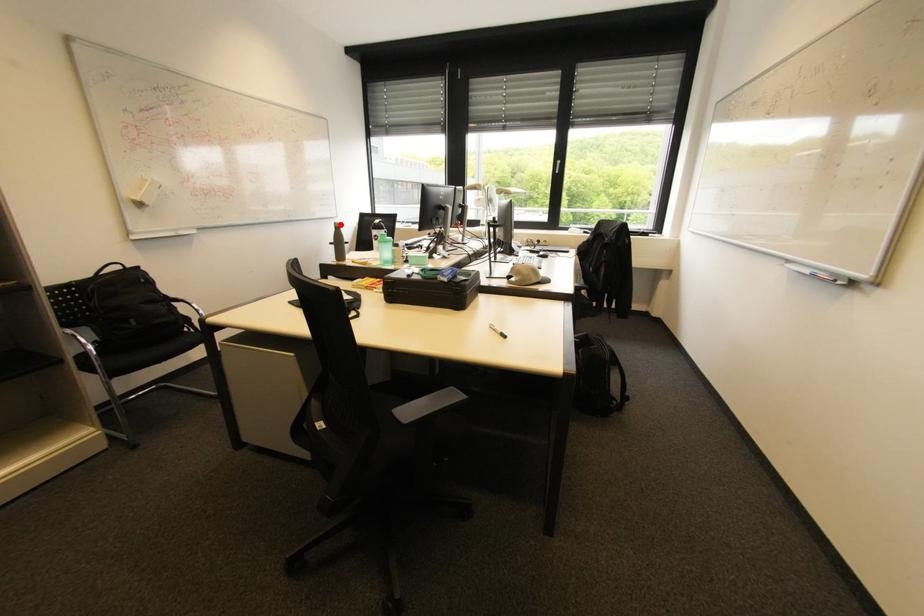
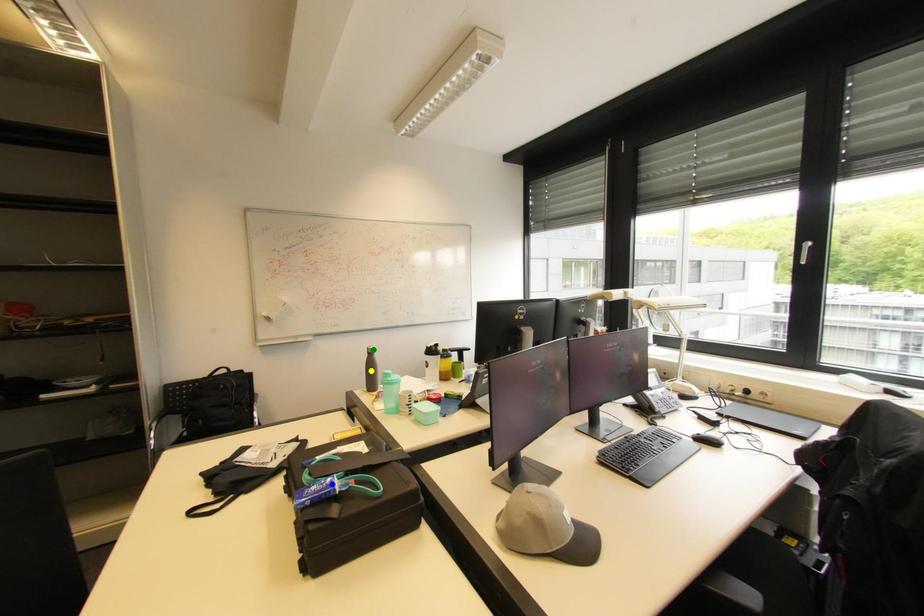
Question: I am providing you with two images of the same scene from different viewpoints. A red point is marked on the first image. You are given multiple points on the second image. Can you choose the point in image 2 that corresponds to the point in image 1?

Choices:
 (A) yellow point
 (B) blue point
 (C) green point

Answer: (C)